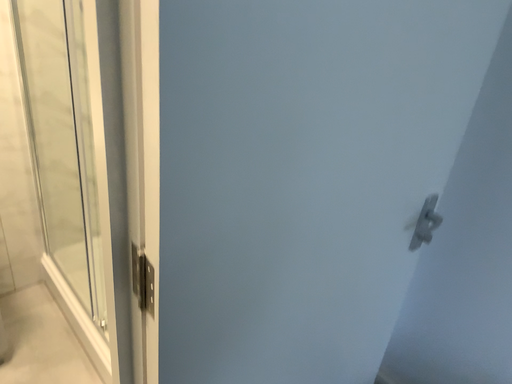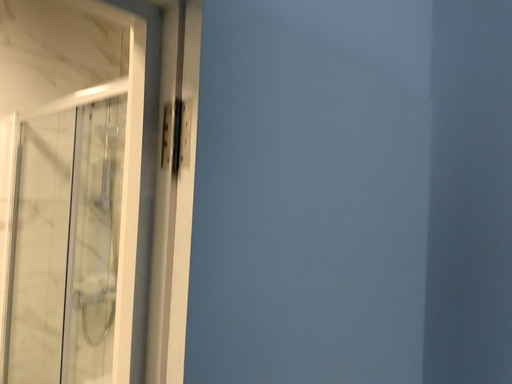
Question: Which way did the camera rotate in the video?

Choices:
 (A) rotated downward
 (B) rotated upward

Answer: (B)